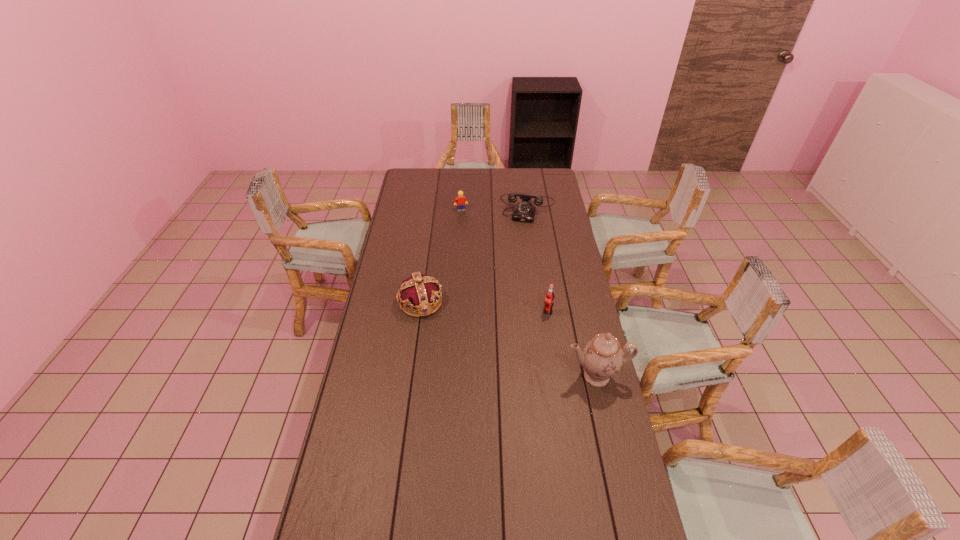
Image resolution: width=960 pixels, height=540 pixels. Find the location of `vacant space located 0.130m on the front-facing side of the telephone`. vacant space located 0.130m on the front-facing side of the telephone is located at coordinates (521, 238).

This screenshot has height=540, width=960. What are the coordinates of `blank space located on the label of the soda bottle` in the screenshot? It's located at (504, 355).

Where is `vacant region located on the label of the soda bottle`? This screenshot has width=960, height=540. vacant region located on the label of the soda bottle is located at coordinates (483, 375).

At what (x,y) coordinates should I click in order to perform the action: click on vacant space located 0.260m on the label of the soda bottle. Please return your answer as a coordinate pair (x, y). Looking at the image, I should click on (505, 353).

Image resolution: width=960 pixels, height=540 pixels. What are the coordinates of `free spot located 0.260m on the front-facing side of the Lego` in the screenshot? It's located at (473, 242).

This screenshot has height=540, width=960. In order to click on vacant space positioned on the front-facing side of the Lego in this screenshot , I will do coord(467,223).

In order to click on vacant space located on the front-facing side of the Lego in this screenshot , I will do `click(468, 227)`.

Identify the location of object that is at the left edge. The image size is (960, 540). (420, 291).

The height and width of the screenshot is (540, 960). Identify the location of chinaware located in the right edge section of the desktop. (602, 357).

Locate an element on the screen. The width and height of the screenshot is (960, 540). telephone present at the right edge is located at coordinates (524, 211).